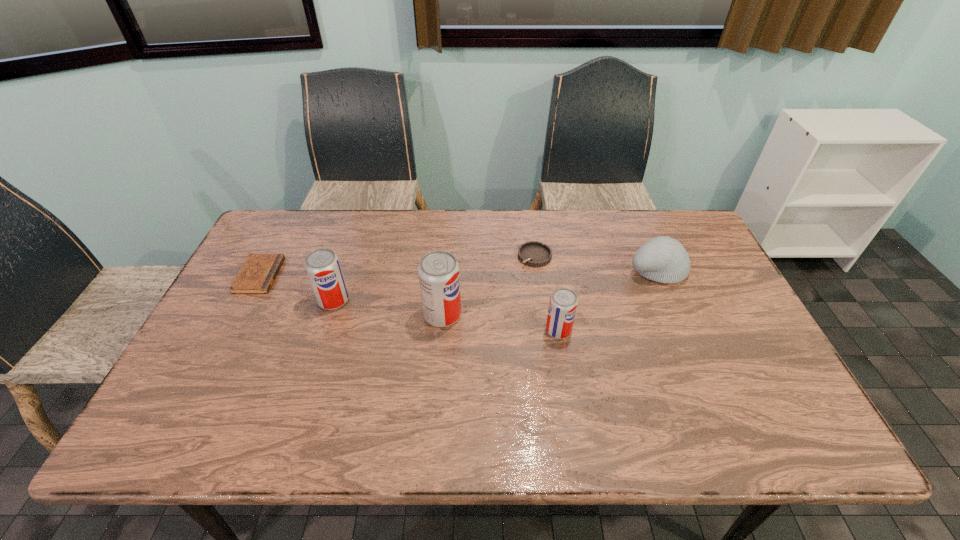
Identify the location of free space between the shortest object and the tallest object. The image size is (960, 540). (351, 295).

I want to click on blank region between the fifth shortest object and the beanie, so (495, 285).

The width and height of the screenshot is (960, 540). In order to click on empty space between the rightmost soda and the rightmost object in this screenshot , I will do `click(608, 300)`.

Identify the location of vacant area that lies between the diary and the fifth object from right to left. (297, 288).

Identify the location of vacant area between the shortest soda and the tallest soda. (500, 322).

Where is `vacant point located between the tallest soda and the shortest soda`? The width and height of the screenshot is (960, 540). vacant point located between the tallest soda and the shortest soda is located at coordinates (500, 322).

Locate an element on the screen. The height and width of the screenshot is (540, 960). object that ranks as the third closest to the second shortest soda is located at coordinates point(533,253).

Point out which object is positioned as the nearest to the shortest soda. Please provide its 2D coordinates. Your answer should be formatted as a tuple, i.e. [(x, y)], where the tuple contains the x and y coordinates of a point satisfying the conditions above.

[(533, 253)]

Image resolution: width=960 pixels, height=540 pixels. Find the location of `the second closest soda to the third object from left to right`. the second closest soda to the third object from left to right is located at coordinates (563, 303).

I want to click on soda that can be found as the second closest to the shortest object, so click(x=439, y=279).